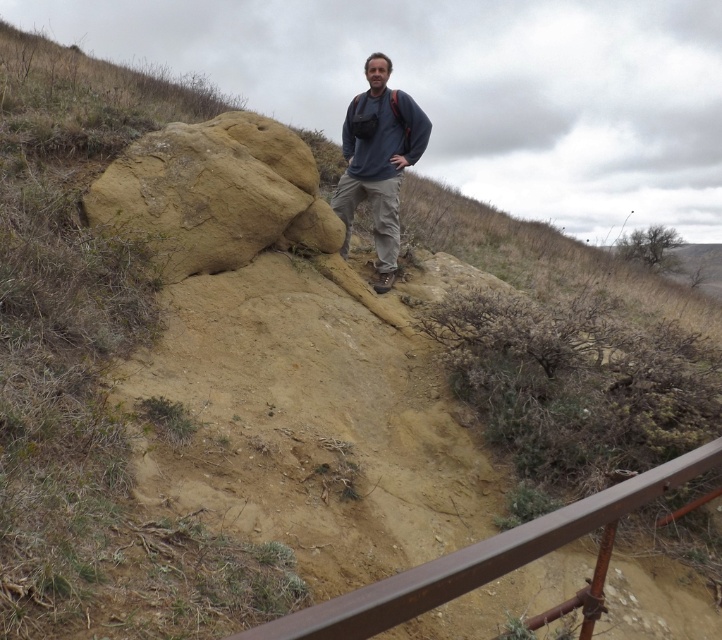
Does point (334, 620) come closer to viewer compared to point (396, 179)?

That is True.

Does brown metal/rustic rail at lower right have a greater height compared to dark blue sweater at center?

No, brown metal/rustic rail at lower right is not taller than dark blue sweater at center.

Is point (456, 573) more distant than point (422, 147)?

No.

Where is `brown metal/rustic rail at lower right`? This screenshot has height=640, width=722. brown metal/rustic rail at lower right is located at coordinates (478, 560).

Based on the photo, between sandy beige rock at center and brown metal/rustic rail at lower right, which one appears on the left side from the viewer's perspective?

From the viewer's perspective, sandy beige rock at center appears more on the left side.

Between sandy beige rock at center and brown metal/rustic rail at lower right, which one has less height?

With less height is brown metal/rustic rail at lower right.

From the picture: Who is more distant from viewer, (199, 145) or (369, 600)?

Point (199, 145)

The width and height of the screenshot is (722, 640). What are the coordinates of `sandy beige rock at center` in the screenshot? It's located at click(206, 192).

Which is behind, point (165, 250) or point (344, 173)?

Positioned behind is point (344, 173).

Is sandy beige rock at center to the right of dark blue sweater at center from the viewer's perspective?

In fact, sandy beige rock at center is to the left of dark blue sweater at center.

Where is `sandy beige rock at center`? sandy beige rock at center is located at coordinates (206, 192).

Find the location of a particular element. sandy beige rock at center is located at coordinates (206, 192).